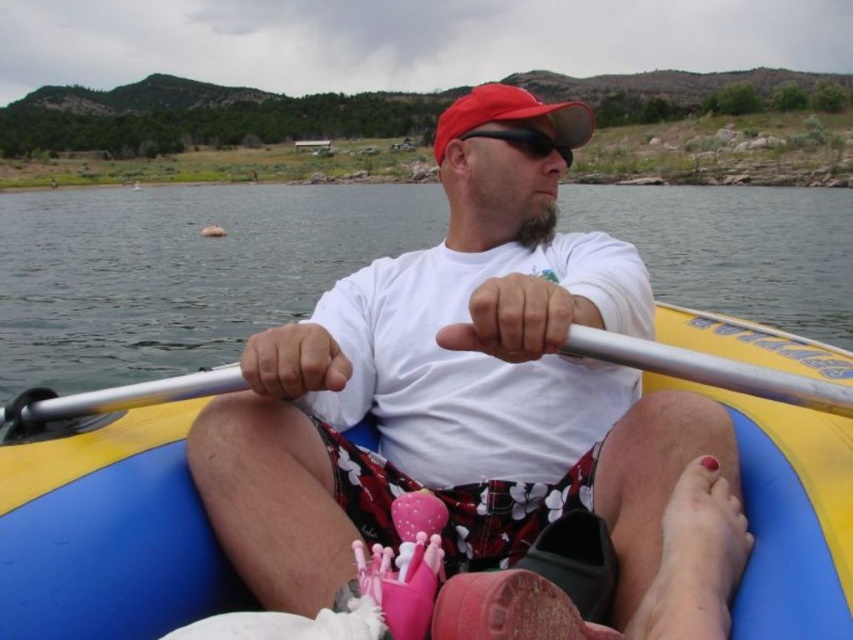
Question: Is white matte t-shirt at center to the right of yellow rubber boat at center from the viewer's perspective?

Choices:
 (A) yes
 (B) no

Answer: (A)

Question: Which point is closer to the camera?

Choices:
 (A) white matte t-shirt at center
 (B) matte red baseball cap at center
 (C) transparent water at center
 (D) silver metallic paddle at center

Answer: (A)

Question: Which of these objects is positioned farthest from the matte red baseball cap at center?

Choices:
 (A) silver metallic paddle at center
 (B) yellow rubber boat at center
 (C) transparent water at center

Answer: (C)

Question: Which of the following is the farthest from the observer?

Choices:
 (A) tap(851, 444)
 (B) tap(201, 381)

Answer: (B)

Question: Is transparent water at center to the right of yellow rubber boat at center from the viewer's perspective?

Choices:
 (A) no
 (B) yes

Answer: (A)

Question: Is white matte t-shirt at center thinner than transparent water at center?

Choices:
 (A) no
 (B) yes

Answer: (B)